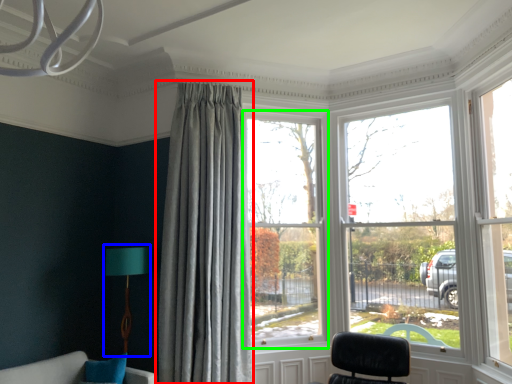
Question: Which object is positioned closest to curtain (highlighted by a red box)? Select from table lamp (highlighted by a blue box) and window (highlighted by a green box).

Choices:
 (A) table lamp
 (B) window

Answer: (B)